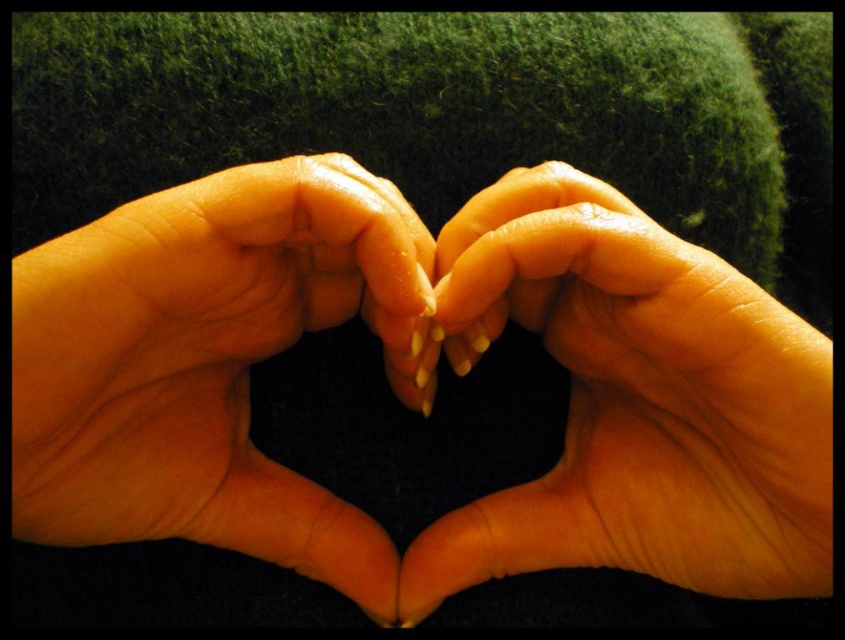
Question: Which object is closer to the camera taking this photo?

Choices:
 (A) smooth skin hand at center
 (B) smooth skin hands at center

Answer: (A)

Question: Which point is farther to the camera?

Choices:
 (A) smooth skin hands at center
 (B) smooth skin hand at center

Answer: (A)

Question: Considering the relative positions of smooth skin hand at center and smooth skin hands at center in the image provided, where is smooth skin hand at center located with respect to smooth skin hands at center?

Choices:
 (A) above
 (B) below

Answer: (A)

Question: Is smooth skin hand at center below smooth skin hands at center?

Choices:
 (A) no
 (B) yes

Answer: (A)

Question: Which point is closer to the camera?

Choices:
 (A) smooth skin hand at center
 (B) smooth skin hands at center

Answer: (A)

Question: Is smooth skin hand at center bigger than smooth skin hands at center?

Choices:
 (A) yes
 (B) no

Answer: (A)